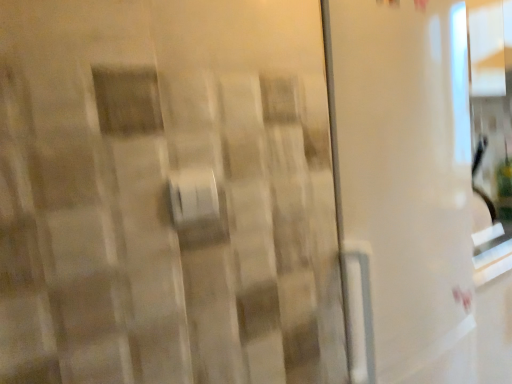
The image size is (512, 384). Describe the element at coordinates (193, 196) in the screenshot. I see `white plastic towel bar at center` at that location.

In order to click on white plastic towel bar at center in this screenshot , I will do coord(193,196).

The width and height of the screenshot is (512, 384). Identify the location of transparent plastic screen door at center. (404, 170).

This screenshot has height=384, width=512. What do you see at coordinates (404, 170) in the screenshot?
I see `transparent plastic screen door at center` at bounding box center [404, 170].

Where is `white plastic towel bar at center`? The width and height of the screenshot is (512, 384). white plastic towel bar at center is located at coordinates (193, 196).

Consider the image. Can you confirm if white plastic towel bar at center is positioned to the right of transparent plastic screen door at center?

Incorrect, white plastic towel bar at center is not on the right side of transparent plastic screen door at center.

Who is more distant, white plastic towel bar at center or transparent plastic screen door at center?

transparent plastic screen door at center is further away from the camera.

Which is closer to the camera, (190, 213) or (408, 69)?

Point (190, 213) appears to be closer to the viewer than point (408, 69).

From the image's perspective, is white plastic towel bar at center located above transparent plastic screen door at center?

Correct, white plastic towel bar at center appears higher than transparent plastic screen door at center in the image.

From a real-world perspective, is white plastic towel bar at center physically above transparent plastic screen door at center?

Indeed, from a real-world perspective, white plastic towel bar at center stands above transparent plastic screen door at center.

Is white plastic towel bar at center wider than transparent plastic screen door at center?

No.

Considering the sizes of white plastic towel bar at center and transparent plastic screen door at center in the image, is white plastic towel bar at center taller or shorter than transparent plastic screen door at center?

In the image, white plastic towel bar at center appears to be shorter than transparent plastic screen door at center.

Considering the sizes of white plastic towel bar at center and transparent plastic screen door at center in the image, is white plastic towel bar at center bigger or smaller than transparent plastic screen door at center?

Clearly, white plastic towel bar at center is smaller in size than transparent plastic screen door at center.

Is transparent plastic screen door at center located within white plastic towel bar at center?

No, transparent plastic screen door at center is not inside white plastic towel bar at center.

Is there a large distance between white plastic towel bar at center and transparent plastic screen door at center?

No, white plastic towel bar at center is in close proximity to transparent plastic screen door at center.

Is white plastic towel bar at center facing away from transparent plastic screen door at center?

No.

What's the angular difference between white plastic towel bar at center and transparent plastic screen door at center's facing directions?

There is a 1.79-degree angle between the facing directions of white plastic towel bar at center and transparent plastic screen door at center.

Where is `towel bar located above the transparent plastic screen door at center (from a real-world perspective)`? This screenshot has width=512, height=384. towel bar located above the transparent plastic screen door at center (from a real-world perspective) is located at coordinates (193, 196).

Does transparent plastic screen door at center appear on the left side of white plastic towel bar at center?

Incorrect, transparent plastic screen door at center is not on the left side of white plastic towel bar at center.

Considering the positions of objects transparent plastic screen door at center and white plastic towel bar at center in the image provided, who is in front, transparent plastic screen door at center or white plastic towel bar at center?

white plastic towel bar at center.

Is point (368, 141) closer or farther from the camera than point (197, 194)?

Point (368, 141) appears to be farther away from the viewer than point (197, 194).

From the image's perspective, who appears lower, transparent plastic screen door at center or white plastic towel bar at center?

transparent plastic screen door at center, from the image's perspective.

From a real-world perspective, does transparent plastic screen door at center stand above white plastic towel bar at center?

No.

Considering the sizes of objects transparent plastic screen door at center and white plastic towel bar at center in the image provided, who is thinner, transparent plastic screen door at center or white plastic towel bar at center?

white plastic towel bar at center.

Consider the image. Considering the relative sizes of transparent plastic screen door at center and white plastic towel bar at center in the image provided, is transparent plastic screen door at center taller than white plastic towel bar at center?

Indeed, transparent plastic screen door at center has a greater height compared to white plastic towel bar at center.

Considering the relative sizes of transparent plastic screen door at center and white plastic towel bar at center in the image provided, is transparent plastic screen door at center smaller than white plastic towel bar at center?

Incorrect, transparent plastic screen door at center is not smaller in size than white plastic towel bar at center.

Does transparent plastic screen door at center contain white plastic towel bar at center?

Definitely not — white plastic towel bar at center is not inside transparent plastic screen door at center.

Is transparent plastic screen door at center far from white plastic towel bar at center?

That's not correct — transparent plastic screen door at center is a little close to white plastic towel bar at center.

Is transparent plastic screen door at center oriented away from white plastic towel bar at center?

No, transparent plastic screen door at center is not facing away from white plastic towel bar at center.

How different are the orientations of transparent plastic screen door at center and white plastic towel bar at center in degrees?

They differ by 1.79 degrees in their facing directions.

How distant is transparent plastic screen door at center from white plastic towel bar at center?

transparent plastic screen door at center and white plastic towel bar at center are 24.69 inches apart.

This screenshot has width=512, height=384. In order to click on screen door below the white plastic towel bar at center (from the image's perspective) in this screenshot , I will do `click(404, 170)`.

You are a GUI agent. You are given a task and a screenshot of the screen. Output one action in this format:
    pyautogui.click(x=<x>, y=<y>)
    Task: Click on the screen door located below the white plastic towel bar at center (from the image's perspective)
    
    Given the screenshot: What is the action you would take?
    pyautogui.click(x=404, y=170)

You are a GUI agent. You are given a task and a screenshot of the screen. Output one action in this format:
    pyautogui.click(x=<x>, y=<y>)
    Task: Click on the towel bar lying above the transparent plastic screen door at center (from the image's perspective)
    
    Given the screenshot: What is the action you would take?
    pyautogui.click(x=193, y=196)